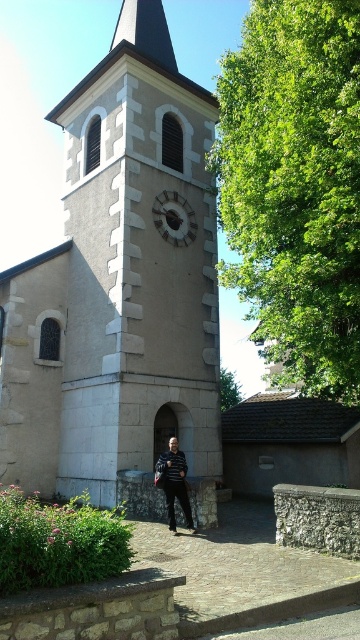
You are a visitor approaching the church entrance and notice the matte gray clock at center and the striped sweater at center. Which object is located to the left when facing the church?

The matte gray clock at center is positioned on the left side of striped sweater at center, so when facing the church, the matte gray clock at center is to the left of the striped sweater at center.

You are standing at the entrance of the church and want to take a photo of the stone clock tower at center. Where should you position yourself to capture the tower in the frame?

The stone clock tower at center is located at point 2D coordinates [119,291], so you should position yourself at the entrance facing towards the coordinates [119,291] to capture it in the frame.